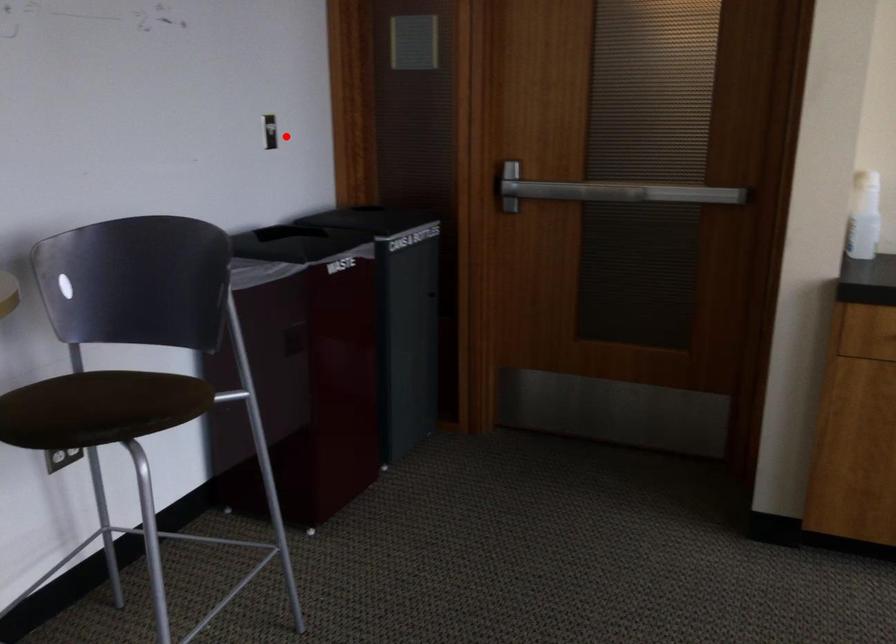
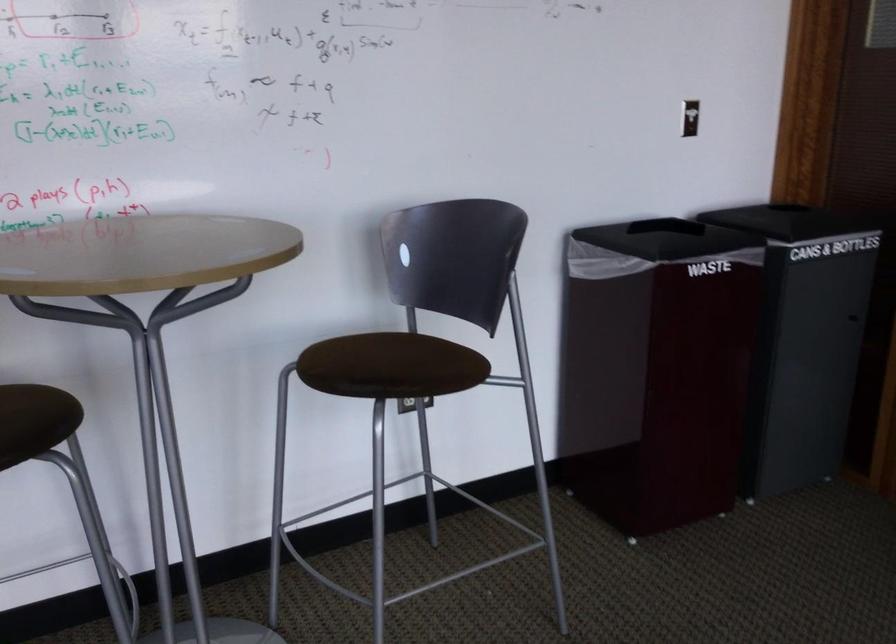
Question: I am providing you with two images of the same scene from different viewpoints. Image1 has a red point marked. In image2, the corresponding 3D location appears at what relative position? Reply with the corresponding letter.

Choices:
 (A) Closer
 (B) Farther

Answer: (A)